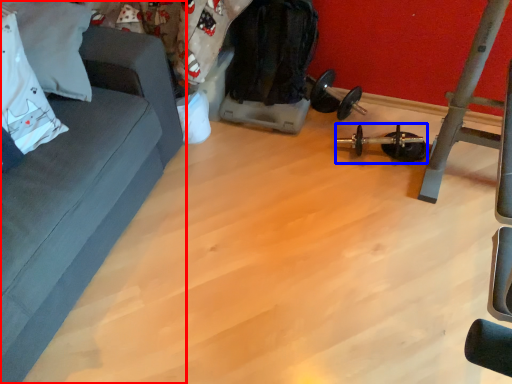
Question: Which point is further to the camera, studio couch (highlighted by a red box) or equipment (highlighted by a blue box)?

Choices:
 (A) studio couch
 (B) equipment

Answer: (B)